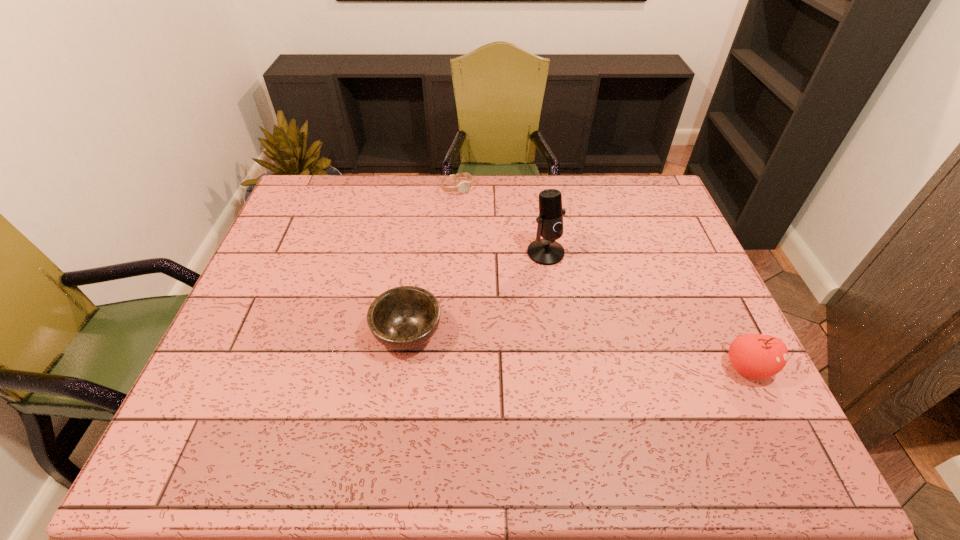
You are a GUI agent. You are given a task and a screenshot of the screen. Output one action in this format:
    pyautogui.click(x=<x>, y=<y>)
    Task: Click on the vacant space located 0.210m on the stand of the microphone
    The image size is (960, 540).
    Given the screenshot: What is the action you would take?
    pyautogui.click(x=583, y=320)

Identify the location of free space located 0.380m on the stand of the microphone. (613, 375).

Locate an element on the screen. The height and width of the screenshot is (540, 960). vacant space located on the face of the shortest object is located at coordinates (510, 248).

Identify the location of free location located 0.280m on the face of the shortest object. (505, 242).

You are a GUI agent. You are given a task and a screenshot of the screen. Output one action in this format:
    pyautogui.click(x=<x>, y=<y>)
    Task: Click on the free point located on the face of the shortest object
    
    Given the screenshot: What is the action you would take?
    pyautogui.click(x=509, y=246)

At what (x,y) coordinates should I click in order to perform the action: click on object that is at the far edge. Please return your answer as a coordinate pair (x, y). The image size is (960, 540). Looking at the image, I should click on (463, 186).

This screenshot has width=960, height=540. Find the location of `object present at the near edge`. object present at the near edge is located at coordinates (758, 356).

Identify the location of object that is positioned at the right edge. This screenshot has width=960, height=540. (758, 356).

Find the location of a particular element. The width and height of the screenshot is (960, 540). object positioned at the near right corner is located at coordinates (758, 356).

Locate an element on the screen. free space at the far edge of the desktop is located at coordinates (389, 204).